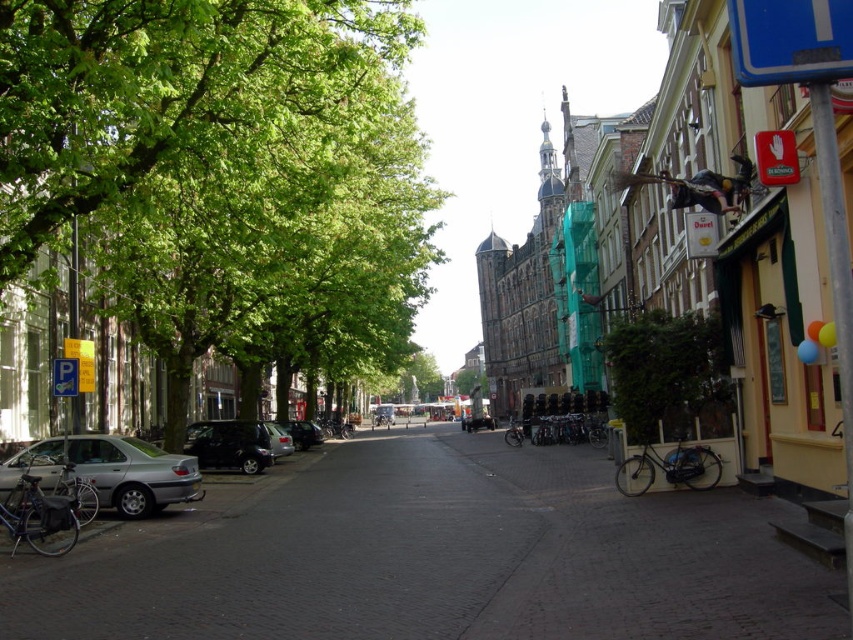
Describe the element at coordinates (669, 468) in the screenshot. I see `shiny black bicycle at lower right` at that location.

What do you see at coordinates (669, 468) in the screenshot? I see `shiny black bicycle at lower right` at bounding box center [669, 468].

Identify the location of shiny black bicycle at lower right. (669, 468).

Measure the distance between black matte bicycle at center and camera.

The distance of black matte bicycle at center from camera is 35.82 meters.

At what (x,y) coordinates should I click in order to perform the action: click on black matte bicycle at center. Please return your answer as a coordinate pair (x, y). The width and height of the screenshot is (853, 640). Looking at the image, I should click on (560, 429).

Does shiny metallic bicycle at center appear over silver metallic bicycle at center?

Yes.

Which is behind, point (323, 428) or point (381, 408)?

The point (381, 408) is behind.

The width and height of the screenshot is (853, 640). Identify the location of shiny metallic bicycle at center. (337, 428).